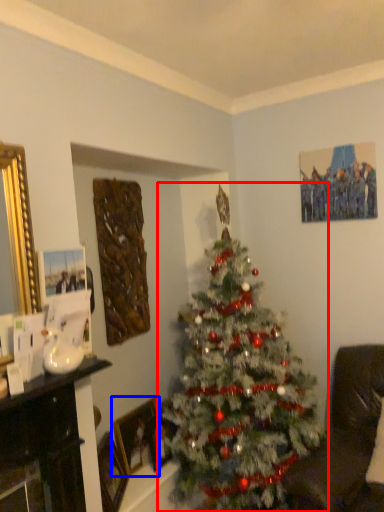
Question: Which of the following is the closest to the observer, christmas tree (highlighted by a red box) or picture frame (highlighted by a blue box)?

Choices:
 (A) christmas tree
 (B) picture frame

Answer: (A)